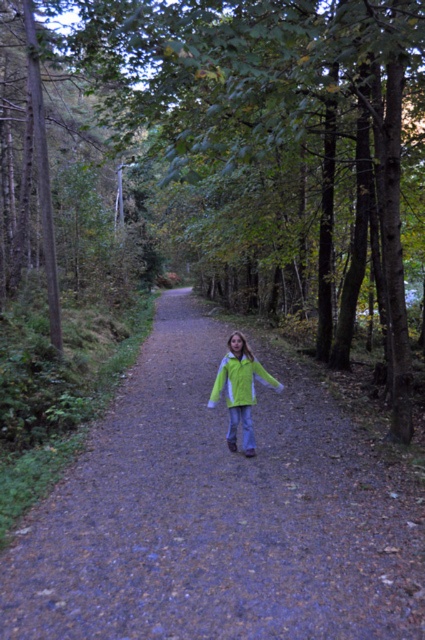
You are standing at the point labeled as point (255, 65) in the forest scene. You want to take a photo of the young girl in the center of the path using a camera that has a focal length of 50mm. The camera is positioned 5.87 meters away from the point. Will the girl be in the frame if the camera is aimed directly at the point?

The camera is positioned 5.87 meters away from point (255, 65), which is where you are standing. Since the young girl is in the center of the path, aiming the camera directly at the point would mean the girl is in the frame.

You are a hiker who wants to walk along the dirt path at center while avoiding stepping on the neon green fabric jacket at center. Which direction should you move relative to the jacket to stay on the path?

The dirt path at center is to the left of the neon green fabric jacket at center, so you should move to the left of the jacket to stay on the path.

You are standing at the point with coordinates point (119, 394) and want to walk to point (246, 392). Which direction should you move to get closer to your destination?

You should move away from the viewer because point (246, 392) is further away from the viewer than point (119, 394).